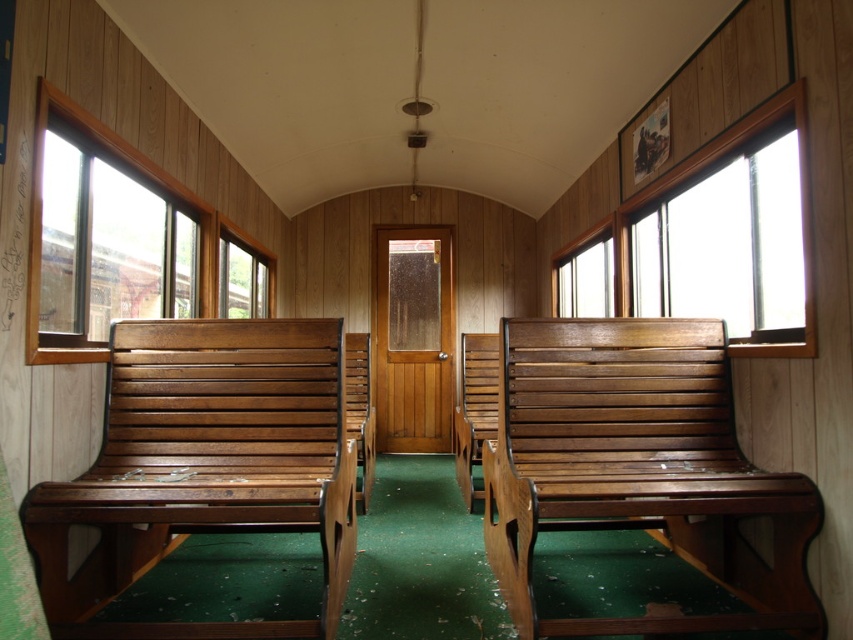
Which is behind, point (547, 483) or point (120, 419)?

The point (120, 419) is more distant.

Between shiny brown wood bench at center and shiny brown wood bench at left, which one appears on the left side from the viewer's perspective?

shiny brown wood bench at left is more to the left.

Which is in front, point (515, 493) or point (149, 336)?

Point (515, 493)

This screenshot has width=853, height=640. Find the location of `shiny brown wood bench at center`. shiny brown wood bench at center is located at coordinates (637, 467).

Is shiny brown wood bench at center bigger than wooden bench at center?

Yes, shiny brown wood bench at center is bigger than wooden bench at center.

Can you confirm if shiny brown wood bench at center is positioned to the right of wooden bench at center?

Correct, you'll find shiny brown wood bench at center to the right of wooden bench at center.

Locate an element on the screen. The image size is (853, 640). shiny brown wood bench at center is located at coordinates point(637,467).

Can you confirm if clear glass window at upper right is positioned to the left of clear glass window at center right?

No, clear glass window at upper right is not to the left of clear glass window at center right.

Does clear glass window at upper right have a smaller size compared to clear glass window at center right?

Actually, clear glass window at upper right might be larger than clear glass window at center right.

You are a GUI agent. You are given a task and a screenshot of the screen. Output one action in this format:
    pyautogui.click(x=<x>, y=<y>)
    Task: Click on the clear glass window at upper right
    The width and height of the screenshot is (853, 640).
    Given the screenshot: What is the action you would take?
    pyautogui.click(x=712, y=240)